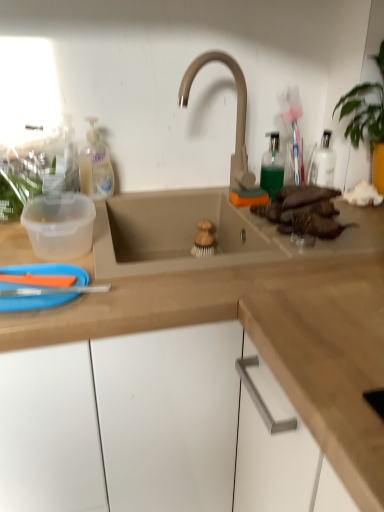
Find the location of a particular element. The width and height of the screenshot is (384, 512). free spot in front of brown matte sweet potato at right is located at coordinates (303, 251).